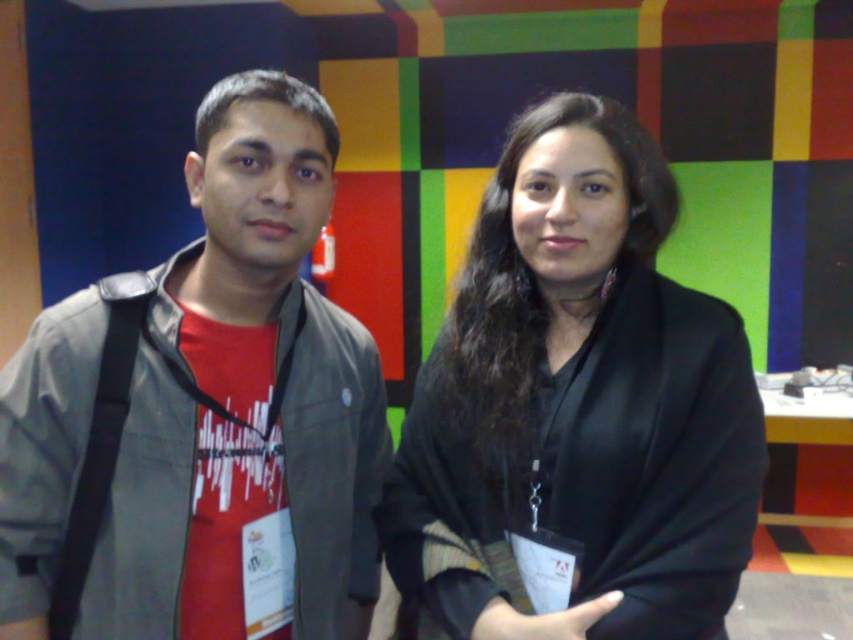
Question: Is matte gray jacket at left to the right of black matte/black fabric at center from the viewer's perspective?

Choices:
 (A) yes
 (B) no

Answer: (B)

Question: Which point is farther from the camera taking this photo?

Choices:
 (A) (62, 328)
 (B) (618, 320)

Answer: (B)

Question: Is matte gray jacket at left below black matte/black fabric at center?

Choices:
 (A) no
 (B) yes

Answer: (B)

Question: Among these points, which one is farthest from the camera?

Choices:
 (A) (283, 248)
 (B) (570, 125)

Answer: (B)

Question: Is matte gray jacket at left to the right of black matte/black fabric at center from the viewer's perspective?

Choices:
 (A) yes
 (B) no

Answer: (B)